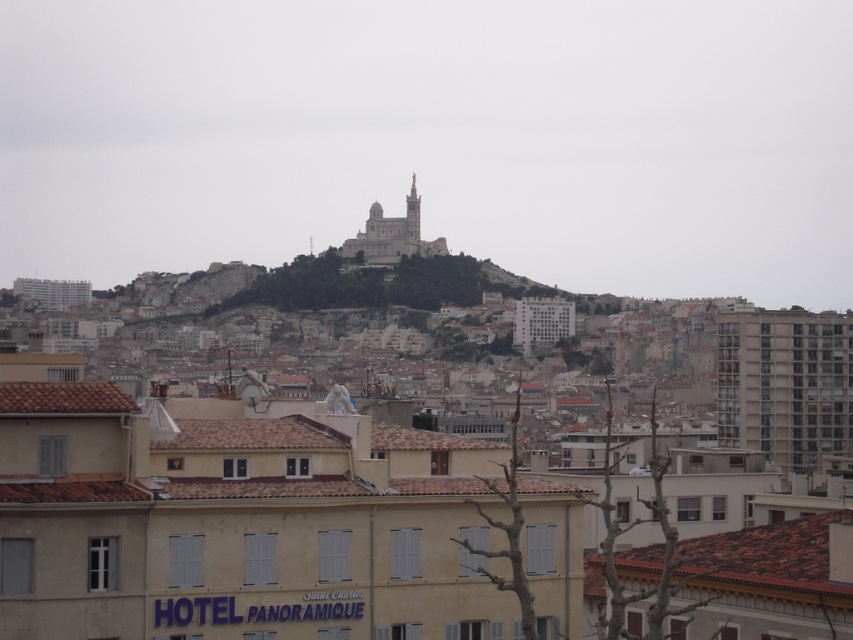
Does gray concrete building at right have a greater height compared to white stone church at upper center?

In fact, gray concrete building at right may be shorter than white stone church at upper center.

Who is taller, gray concrete building at right or white stone church at upper center?

white stone church at upper center

Identify the location of gray concrete building at right. (785, 385).